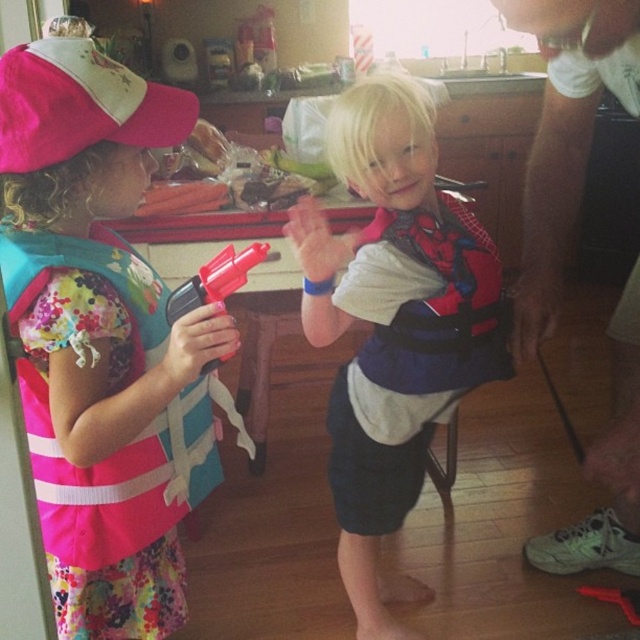
Question: Can you confirm if pink fabric backpack at left is smaller than spiderman-patterned life vest at center?

Choices:
 (A) no
 (B) yes

Answer: (B)

Question: Where is pink fabric backpack at left located in relation to spiderman-patterned life vest at center in the image?

Choices:
 (A) below
 (B) above

Answer: (B)

Question: Which point is closer to the camera taking this photo?

Choices:
 (A) (102, 122)
 (B) (420, 470)

Answer: (A)

Question: Which is nearer to the pink fabric backpack at left?

Choices:
 (A) spiderman-patterned life vest at center
 (B) pink fabric backpack at center

Answer: (A)

Question: Is spiderman-patterned life vest at center to the right of pink fabric backpack at center from the viewer's perspective?

Choices:
 (A) no
 (B) yes

Answer: (A)

Question: Based on their relative distances, which object is farther from the pink fabric backpack at center?

Choices:
 (A) pink fabric backpack at left
 (B) spiderman-patterned life vest at center

Answer: (A)